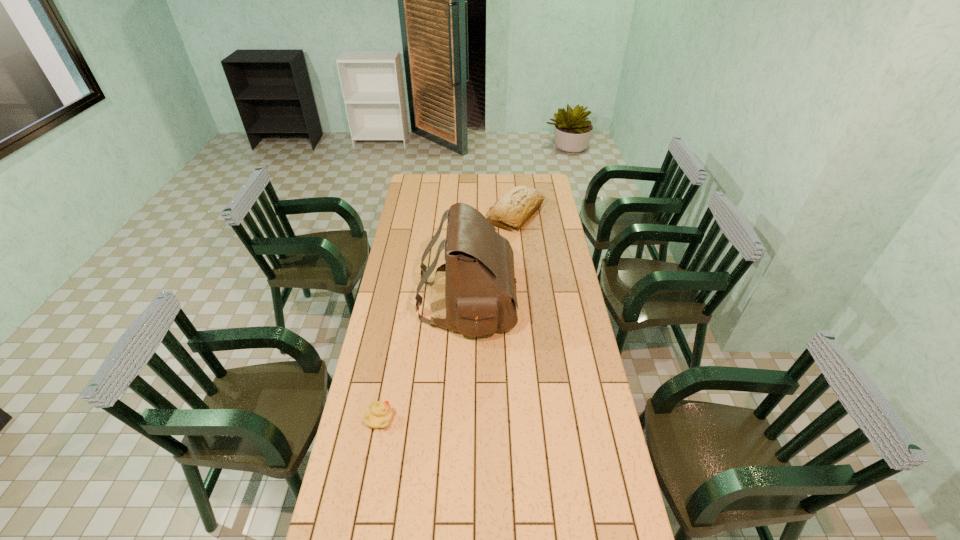
Locate an element on the screen. object located at the right edge is located at coordinates (515, 208).

Find the location of a particular element. Image resolution: width=960 pixels, height=540 pixels. free space at the far edge of the desktop is located at coordinates (455, 191).

At what (x,y) coordinates should I click in order to perform the action: click on vacant space at the left edge of the desktop. Please return your answer as a coordinate pair (x, y). Looking at the image, I should click on (375, 351).

Image resolution: width=960 pixels, height=540 pixels. In the image, there is a desktop. Find the location of `vacant region at the right edge`. vacant region at the right edge is located at coordinates (546, 214).

At what (x,y) coordinates should I click in order to perform the action: click on free space between the leftmost object and the tallest object. Please return your answer as a coordinate pair (x, y). This screenshot has width=960, height=540. Looking at the image, I should click on (423, 361).

I want to click on free point between the satchel and the duckling, so click(423, 361).

At what (x,y) coordinates should I click in order to perform the action: click on object that is the closest to the bread. Please return your answer as a coordinate pair (x, y). Looking at the image, I should click on (480, 293).

This screenshot has width=960, height=540. Find the location of `object that stands as the closest to the second tallest object`. object that stands as the closest to the second tallest object is located at coordinates [x=480, y=293].